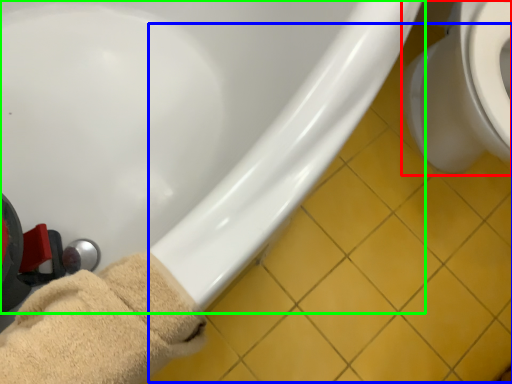
Question: Which object is positioned closest to toilet (highlighted by a red box)? Select from tile (highlighted by a blue box) and bathtub (highlighted by a green box).

Choices:
 (A) tile
 (B) bathtub

Answer: (A)